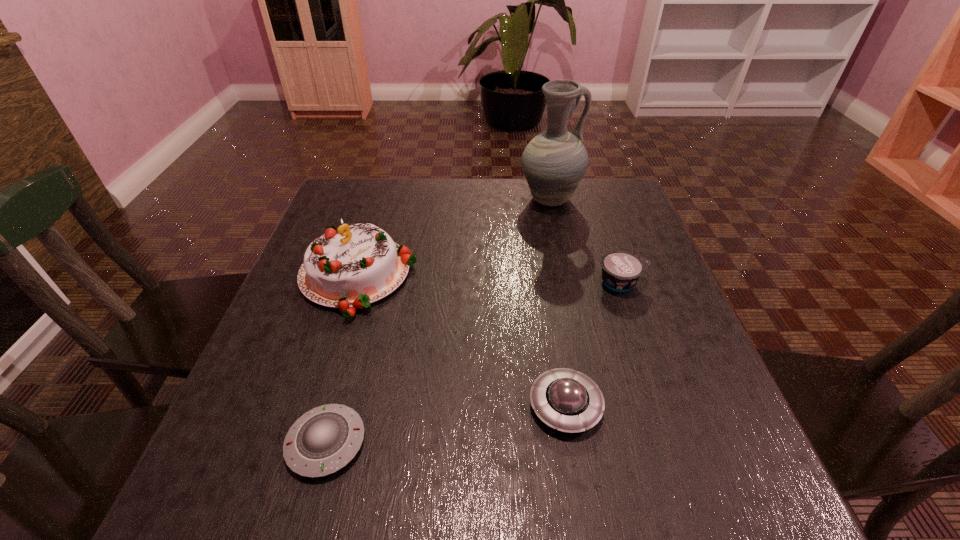
Locate an element on the screen. The height and width of the screenshot is (540, 960). unoccupied area between the fourth shortest object and the yogurt is located at coordinates (490, 280).

Identify the location of unoccupied area between the shortest object and the cake. Image resolution: width=960 pixels, height=540 pixels. (342, 360).

This screenshot has height=540, width=960. What are the coordinates of `vacant area that lies between the yogurt and the tallest object` in the screenshot? It's located at (586, 241).

In order to click on empty location between the shortest object and the cake in this screenshot , I will do `click(342, 360)`.

Identify the location of free spot between the yogurt and the shorter saucer. This screenshot has height=540, width=960. (474, 363).

The height and width of the screenshot is (540, 960). Find the location of `vacant space in between the taller saucer and the shorter saucer`. vacant space in between the taller saucer and the shorter saucer is located at coordinates (445, 424).

What are the coordinates of `object that ranks as the second closest to the cake` in the screenshot? It's located at (570, 401).

The height and width of the screenshot is (540, 960). In order to click on the third closest object to the pitcher in this screenshot , I will do `click(570, 401)`.

Where is `vacant space that satisfies the following two spatial constraints: 1. on the handle side of the tallest object; 2. on the left side of the yogurt`? This screenshot has width=960, height=540. vacant space that satisfies the following two spatial constraints: 1. on the handle side of the tallest object; 2. on the left side of the yogurt is located at coordinates (568, 282).

The image size is (960, 540). Find the location of `vacant space that satisfies the following two spatial constraints: 1. on the handle side of the farthest object; 2. on the back side of the yogurt`. vacant space that satisfies the following two spatial constraints: 1. on the handle side of the farthest object; 2. on the back side of the yogurt is located at coordinates (568, 282).